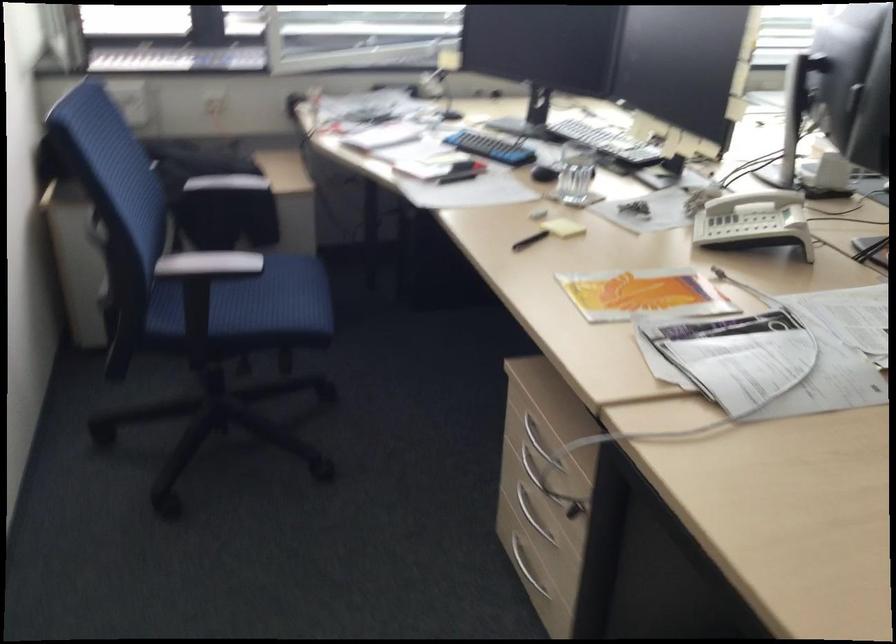
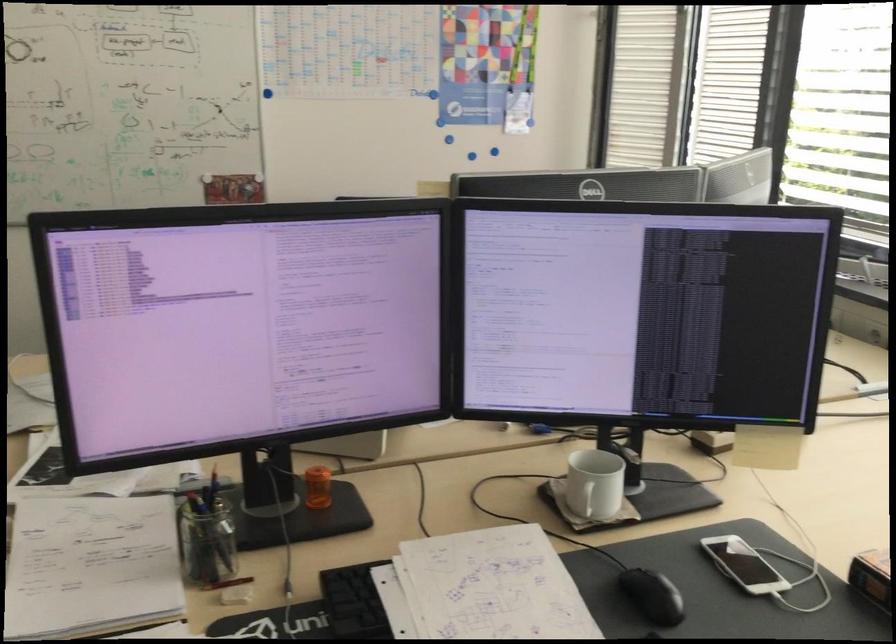
Question: I am providing you with two images of the same scene from different viewpoints. Which of the following objects are not visible in image2?

Choices:
 (A) glass pencil holder
 (B) silver drawer handle
 (C) white smartphone
 (D) orange rolled blanket

Answer: (B)